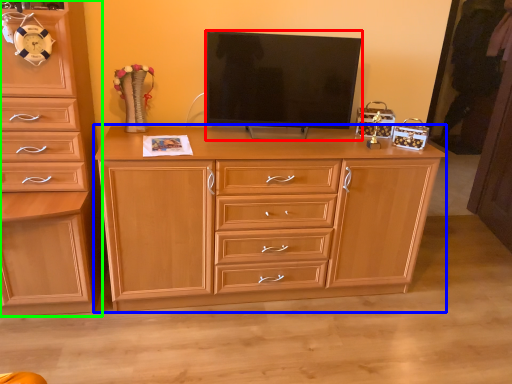
Question: Considering the real-world distances, which object is closest to television (highlighted by a red box)? chest of drawers (highlighted by a blue box) or chest of drawers (highlighted by a green box).

Choices:
 (A) chest of drawers
 (B) chest of drawers

Answer: (A)